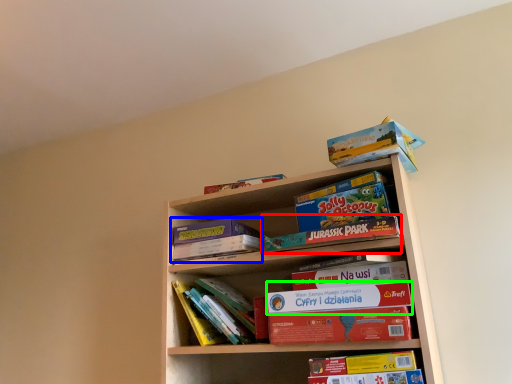
Question: Which object is the farthest from paperback book (highlighted by a red box)? Choose among these: paperback book (highlighted by a blue box) or paperback book (highlighted by a green box).

Choices:
 (A) paperback book
 (B) paperback book

Answer: (A)